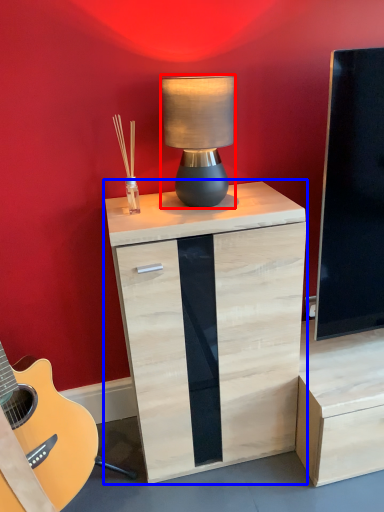
Question: Which of the following is the closest to the observer, lamp (highlighted by a red box) or chest of drawers (highlighted by a blue box)?

Choices:
 (A) lamp
 (B) chest of drawers

Answer: (A)